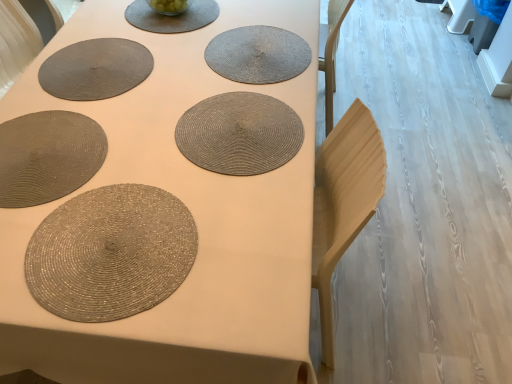
What are the coordinates of `vacant area that lies between matte gray placemat at upper left, arranged as the 3th paper plate when ordered from the bottom, and rattan placemat at lower left, which appears as the second paper plate when viewed from the front` in the screenshot? It's located at (65, 101).